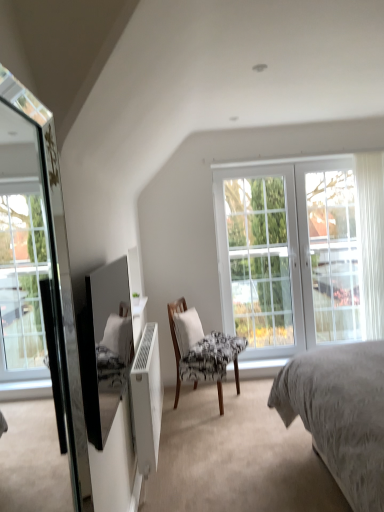
Locate an element on the screen. vacant space to the right of white matte radiator at lower left is located at coordinates (226, 441).